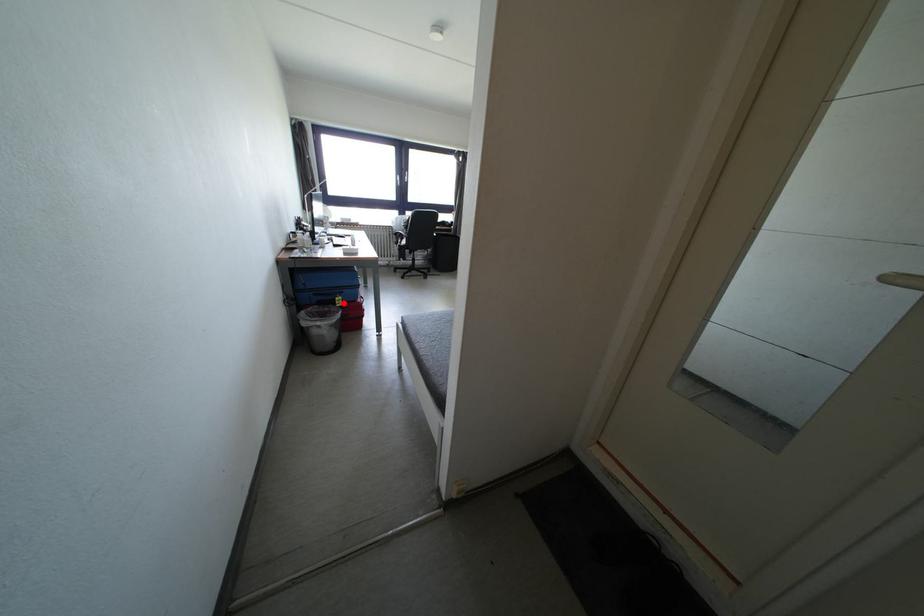
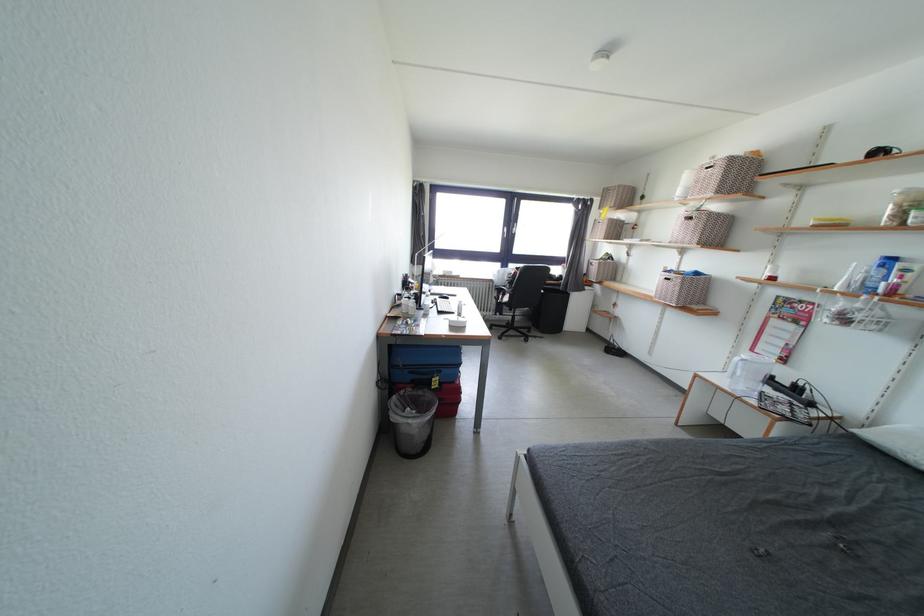
In the second image, find the point that corresponds to the highlighted location in the first image.

(440, 384)